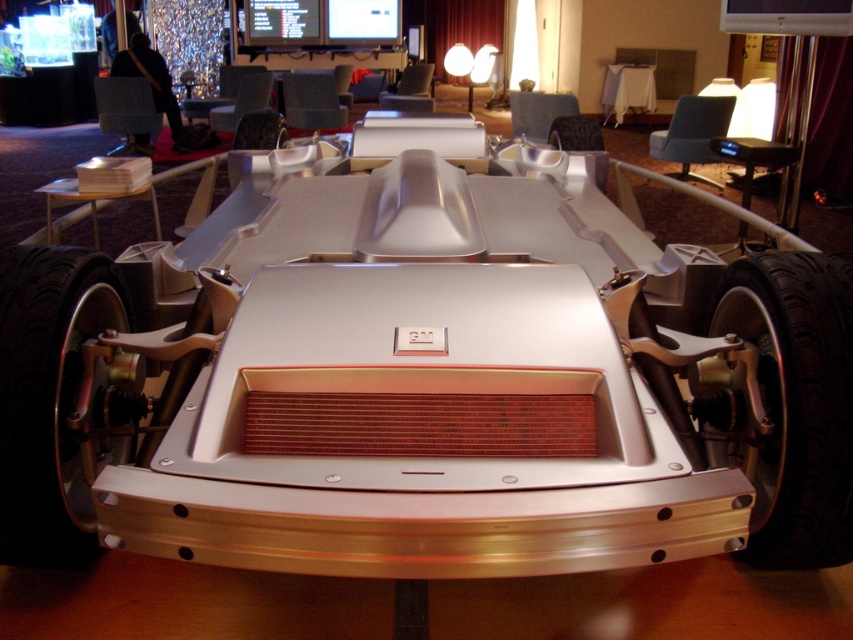
Which is more to the right, black rubber tire at lower right or polished silver wheel at lower left?

From the viewer's perspective, black rubber tire at lower right appears more on the right side.

Can you confirm if black rubber tire at lower right is taller than polished silver wheel at lower left?

Correct, black rubber tire at lower right is much taller as polished silver wheel at lower left.

Where is `black rubber tire at lower right`? The image size is (853, 640). black rubber tire at lower right is located at coordinates (795, 403).

Locate an element on the screen. This screenshot has height=640, width=853. black rubber tire at lower right is located at coordinates (795, 403).

Which is below, metallic silver car at center or black rubber tire at lower right?

black rubber tire at lower right is lower down.

How much distance is there between metallic silver car at center and black rubber tire at lower right?

The distance of metallic silver car at center from black rubber tire at lower right is 29.11 inches.

Does point (209, 268) come closer to viewer compared to point (805, 340)?

That is False.

Find the location of a particular element. The height and width of the screenshot is (640, 853). metallic silver car at center is located at coordinates (425, 384).

Between metallic silver car at center and polished silver wheel at lower left, which one has less height?

polished silver wheel at lower left

Which is behind, point (42, 301) or point (39, 248)?

The point (39, 248) is more distant.

Find the location of `metallic silver car at center`. metallic silver car at center is located at coordinates (425, 384).